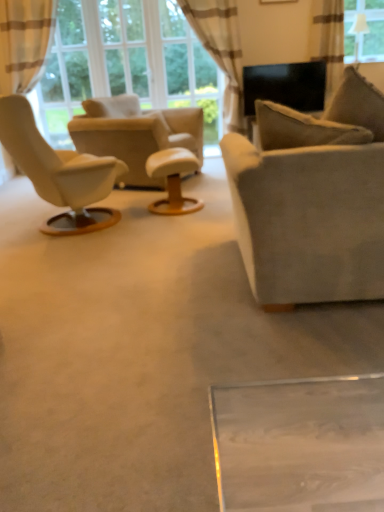
Question: From the image's perspective, is white leather ottoman at center on top of suede couch at center?

Choices:
 (A) yes
 (B) no

Answer: (A)

Question: Considering the relative sizes of white leather ottoman at center and suede couch at center in the image provided, is white leather ottoman at center smaller than suede couch at center?

Choices:
 (A) yes
 (B) no

Answer: (A)

Question: Would you say white leather ottoman at center is outside suede couch at center?

Choices:
 (A) yes
 (B) no

Answer: (A)

Question: From a real-world perspective, is white leather ottoman at center below suede couch at center?

Choices:
 (A) yes
 (B) no

Answer: (A)

Question: Does white leather ottoman at center appear on the right side of suede couch at center?

Choices:
 (A) no
 (B) yes

Answer: (A)

Question: In terms of width, does satin beige curtain at upper right, positioned as the 3th curtain in left-to-right order, look wider or thinner when compared to beige fabric curtain at left, the 1th curtain positioned from the left?

Choices:
 (A) thin
 (B) wide

Answer: (A)

Question: Based on their sizes in the image, would you say satin beige curtain at upper right, the first curtain in the right-to-left sequence, is bigger or smaller than beige fabric curtain at left, the 1th curtain positioned from the left?

Choices:
 (A) small
 (B) big

Answer: (A)

Question: Relative to beige fabric curtain at left, the 1th curtain positioned from the left, is satin beige curtain at upper right, positioned as the 3th curtain in left-to-right order, in front or behind?

Choices:
 (A) behind
 (B) front

Answer: (A)

Question: From the image's perspective, is satin beige curtain at upper right, positioned as the 3th curtain in left-to-right order, above or below beige fabric curtain at left, which is the 3th curtain in right-to-left order?

Choices:
 (A) above
 (B) below

Answer: (A)

Question: Is matte black picture frame at upper center inside the boundaries of white leather ottoman at center, or outside?

Choices:
 (A) outside
 (B) inside

Answer: (A)

Question: Looking at their shapes, would you say matte black picture frame at upper center is wider or thinner than white leather ottoman at center?

Choices:
 (A) wide
 (B) thin

Answer: (B)

Question: Is point (264, 3) closer or farther from the camera than point (185, 162)?

Choices:
 (A) closer
 (B) farther

Answer: (B)

Question: Based on their sizes in the image, would you say matte black picture frame at upper center is bigger or smaller than white leather ottoman at center?

Choices:
 (A) big
 (B) small

Answer: (B)

Question: Considering their positions, is transparent glass window at upper right located in front of or behind beige striped curtain at upper center, which is counted as the 2th curtain, starting from the left?

Choices:
 (A) behind
 (B) front

Answer: (A)

Question: Considering the positions of point tap(377, 0) and point tap(216, 23), is point tap(377, 0) closer or farther from the camera than point tap(216, 23)?

Choices:
 (A) farther
 (B) closer

Answer: (B)